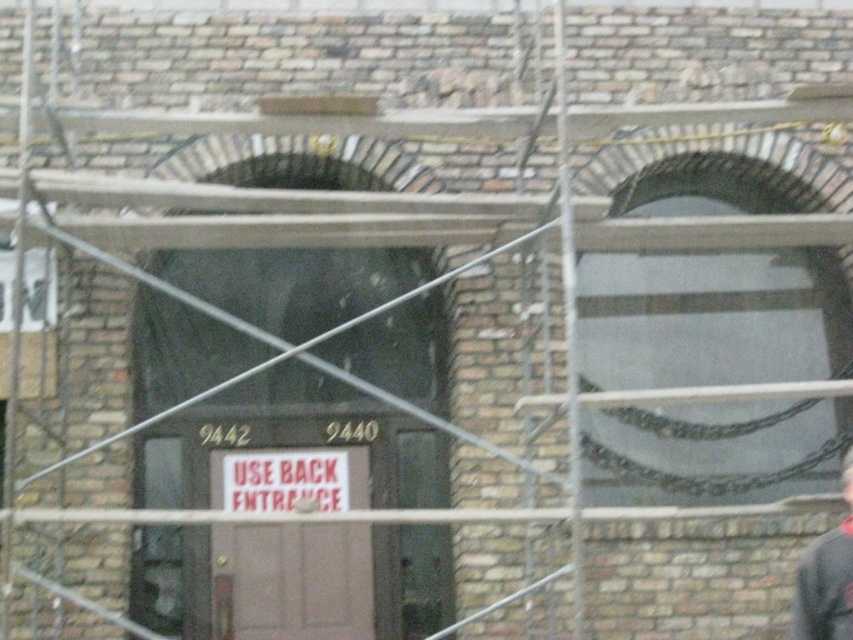
Which is more to the right, metal scaffolding at right or gray fabric construction worker at lower right?

gray fabric construction worker at lower right is more to the right.

Measure the distance between point (578, 616) and camera.

Point (578, 616) is 20.81 feet away from camera.

Where is `metal scaffolding at right`? The height and width of the screenshot is (640, 853). metal scaffolding at right is located at coordinates (567, 321).

Can you confirm if brown matte door at center is taller than metal scaffolding at right?

No, brown matte door at center is not taller than metal scaffolding at right.

Who is positioned more to the left, brown matte door at center or metal scaffolding at right?

Positioned to the left is brown matte door at center.

The height and width of the screenshot is (640, 853). In order to click on brown matte door at center in this screenshot , I will do `click(291, 580)`.

Can you confirm if brown matte door at center is positioned to the right of gray fabric construction worker at lower right?

In fact, brown matte door at center is to the left of gray fabric construction worker at lower right.

Which of these two, brown matte door at center or gray fabric construction worker at lower right, stands taller?

brown matte door at center is taller.

Who is more forward, (305, 637) or (811, 636)?

Point (811, 636)

Where is `brown matte door at center`? The image size is (853, 640). brown matte door at center is located at coordinates (291, 580).